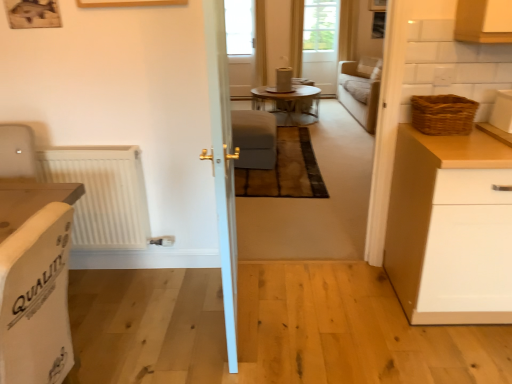
Question: Is point (505, 129) positioned closer to the camera than point (406, 165)?

Choices:
 (A) closer
 (B) farther

Answer: (A)

Question: Would you say white glossy container at upper right, arranged as the second appliance when viewed from the top, is inside or outside white matte cabinet at right?

Choices:
 (A) inside
 (B) outside

Answer: (B)

Question: Estimate the real-world distances between objects in this image. Which object is farther from the white glossy door at center?

Choices:
 (A) transparent glass window at center
 (B) suede-like beige armchair at center, which is counted as the 1th armchair, starting from the top
 (C) white glossy container at upper right, arranged as the second appliance when viewed from the top
 (D) white fabric armchair at left, which is the second armchair from right to left
 (E) woven brown basket at right

Answer: (A)

Question: Which object is the closest to the suede-like beige armchair at center, which ranks as the 1th armchair in back-to-front order?

Choices:
 (A) translucent glass screen door at upper center
 (B) woven brown basket at right
 (C) wooden glass table at center
 (D) white glossy container at upper right, which is the 2th appliance in left-to-right order
 (E) matte cardboard cylinder at center, marked as the first appliance in a back-to-front arrangement

Answer: (C)